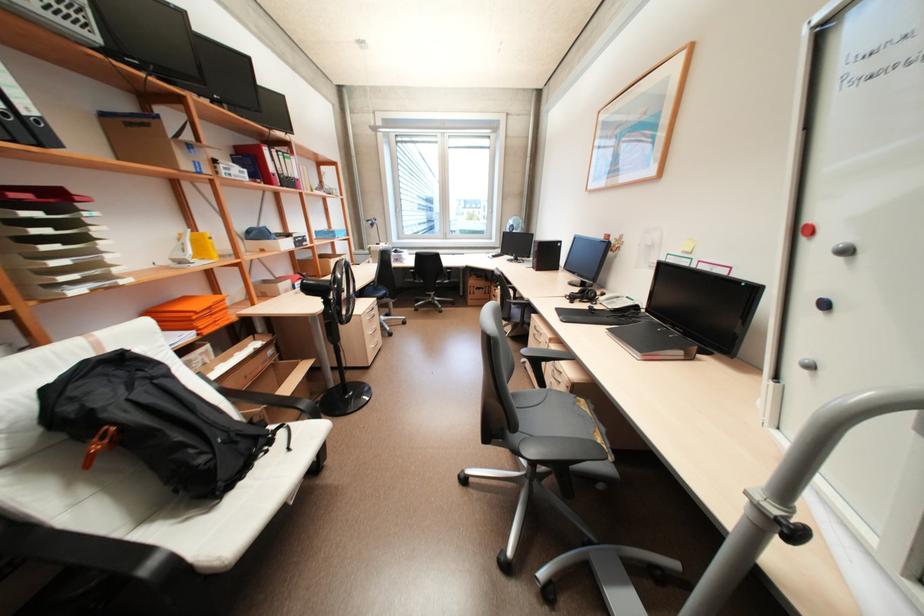
Identify the location of black ring binder. This screenshot has width=924, height=616. pyautogui.click(x=27, y=111).